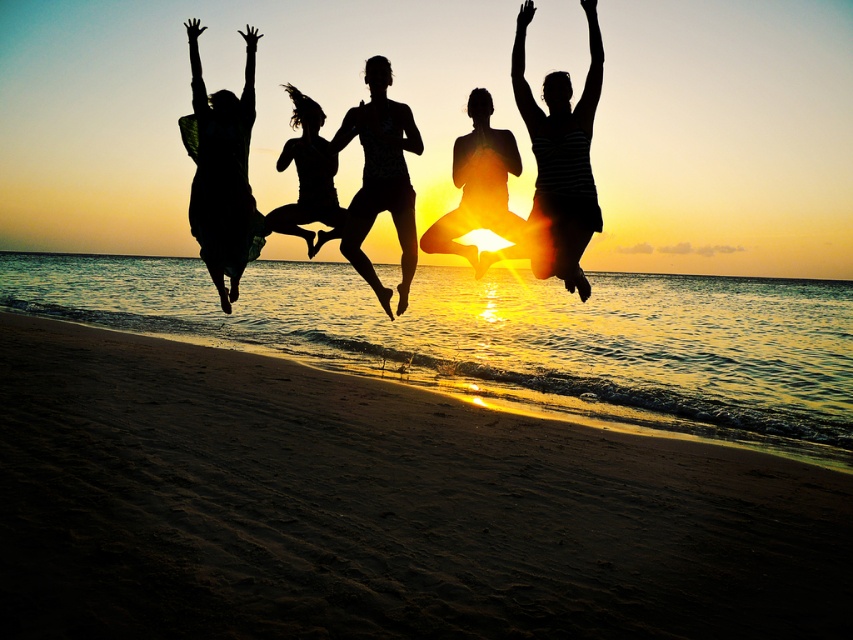
Question: Can you confirm if sandy beach at lower center is wider than silhouette yoga pose at center?

Choices:
 (A) no
 (B) yes

Answer: (B)

Question: Does sandy beach at lower center come in front of silhouette yoga pose at center?

Choices:
 (A) yes
 (B) no

Answer: (A)

Question: Which of the following is the farthest from the observer?

Choices:
 (A) (289, 122)
 (B) (460, 154)

Answer: (A)

Question: Estimate the real-world distances between objects in this image. Which object is closer to the silhouette yoga pose at center?

Choices:
 (A) matte black bikini at center
 (B) black matte figure at center
 (C) striped fabric person at upper right
 (D) black fabric dress at left

Answer: (A)

Question: Is sandy beach at lower center smaller than matte black bikini at center?

Choices:
 (A) no
 (B) yes

Answer: (A)

Question: Which object appears closest to the camera in this image?

Choices:
 (A) black matte figure at center
 (B) black fabric dress at left

Answer: (B)